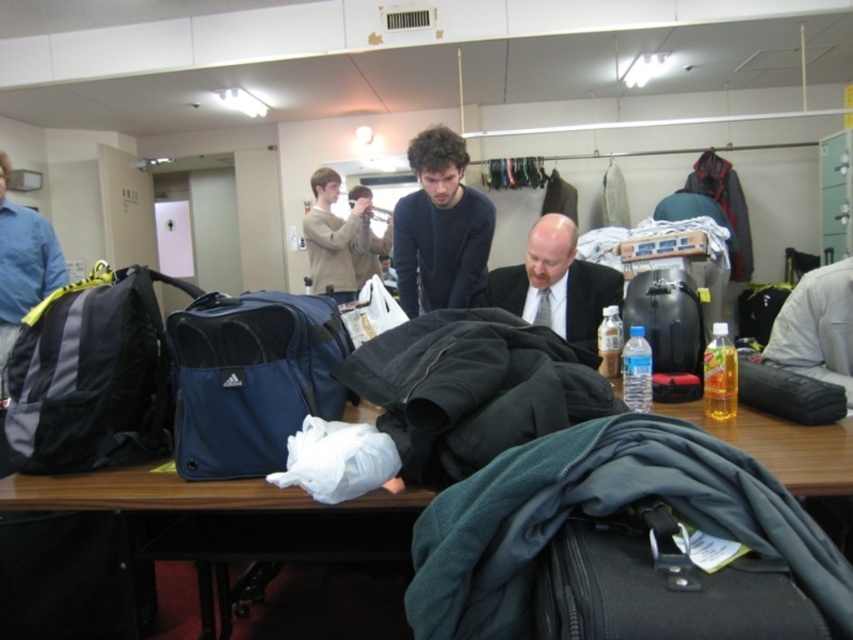
Question: Considering the real-world distances, which object is farthest from the black matte suitcase at lower right?

Choices:
 (A) clear plastic water bottle at center
 (B) wooden table at center

Answer: (A)

Question: Does clear plastic water bottle at center appear on the left side of translucent plastic bottle at center?

Choices:
 (A) yes
 (B) no

Answer: (A)

Question: Where is gray fabric backpack at left located in relation to dark blue sweater at center in the image?

Choices:
 (A) right
 (B) left

Answer: (B)

Question: Which object is positioned closest to the translucent plastic bottle at center?

Choices:
 (A) light brown sweater at center
 (B) translucent yellow bottle at table center
 (C) matte black suitcase at center

Answer: (C)

Question: Which of these objects is positioned closest to the clear plastic water bottle at center?

Choices:
 (A) light brown sweater at center
 (B) matte black suitcase at center

Answer: (B)

Question: Is dark blue sweater at center closer to camera compared to translucent plastic bottle at center?

Choices:
 (A) no
 (B) yes

Answer: (A)